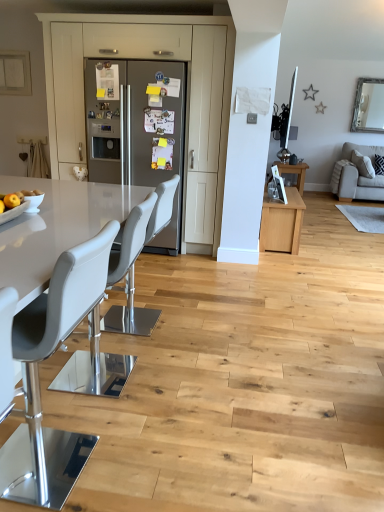
Image resolution: width=384 pixels, height=512 pixels. What are the coordinates of `vacant area that is situated to the right of gray leather chair at left, which is the 3th chair from back to front` in the screenshot? It's located at (155, 456).